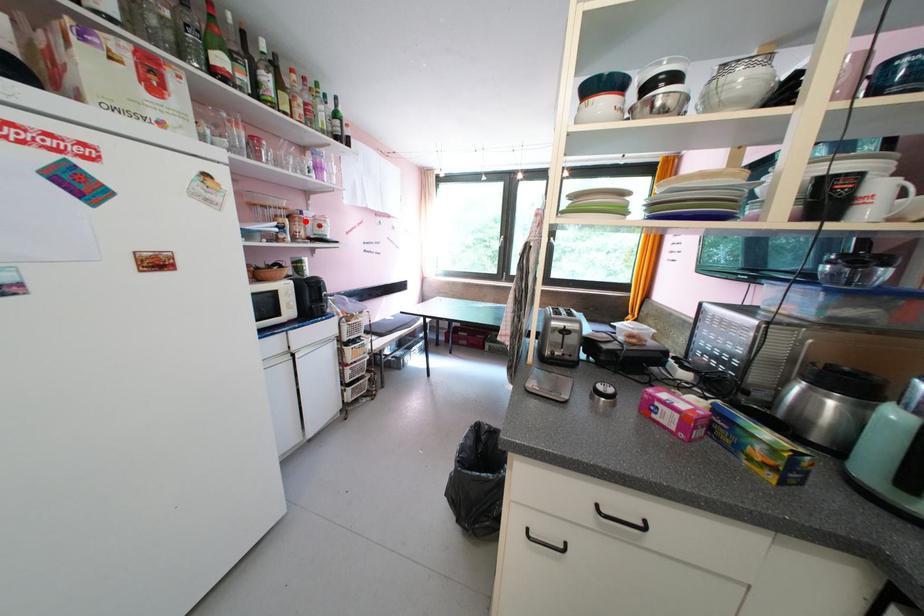
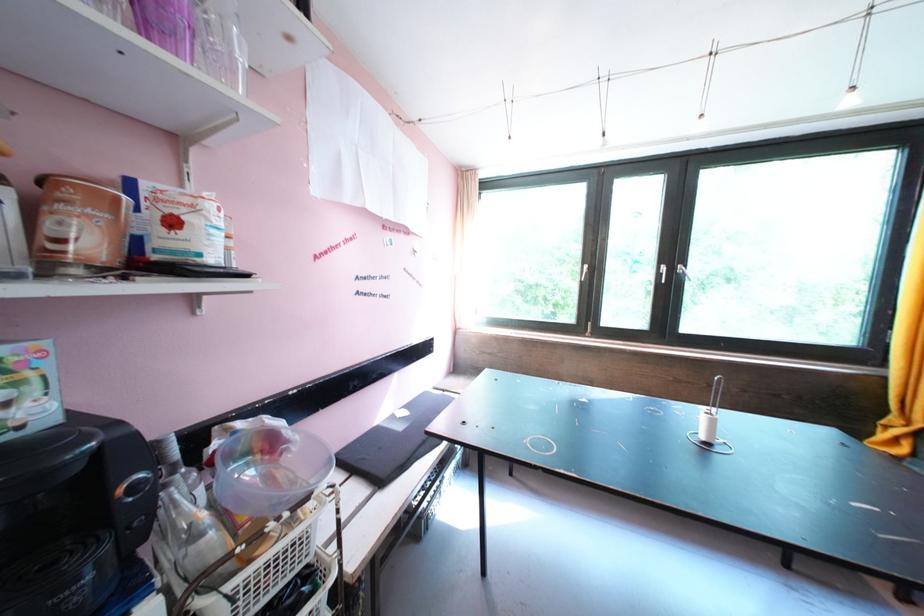
In the second image, find the point that corresponds to the highlighted location in the first image.

(78, 196)